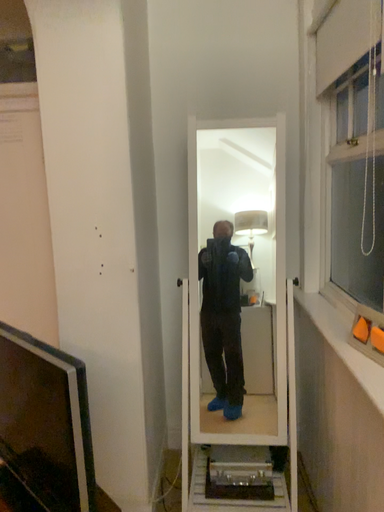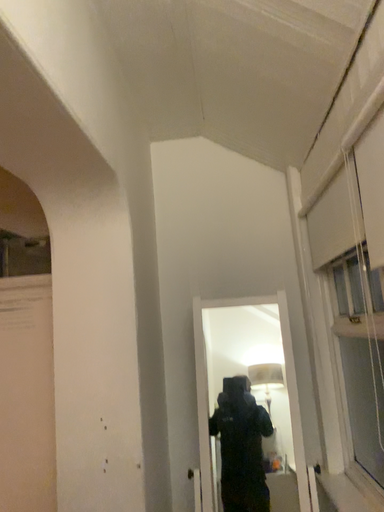
Question: How did the camera likely rotate when shooting the video?

Choices:
 (A) rotated downward
 (B) rotated upward

Answer: (B)